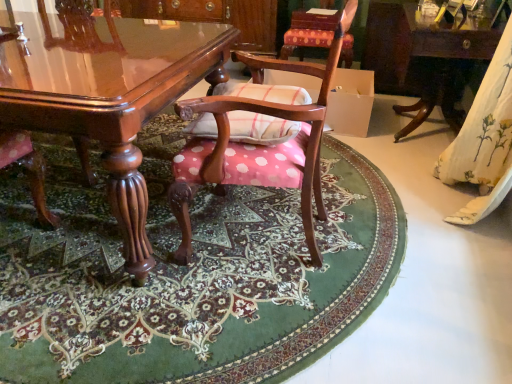
Question: Relative to polka dot fabric chair at center, acting as the 2th chair starting from the bottom, is pink polka dot fabric at center in front or behind?

Choices:
 (A) behind
 (B) front

Answer: (B)

Question: From a real-world perspective, is pink polka dot fabric at center above or below polka dot fabric chair at center, which is counted as the 1th chair, starting from the back?

Choices:
 (A) above
 (B) below

Answer: (B)

Question: Which of these objects is positioned closest to the polka dot fabric chair at center, the first chair from the front?

Choices:
 (A) pink polka dot fabric at center
 (B) polka dot fabric chair at center, the first chair from the top
 (C) glossy wood table at center, the second table viewed from the right
 (D) white floral fabric at right
 (E) wooden table at right, which ranks as the 1th table in right-to-left order

Answer: (C)

Question: Which object is the farthest from the polka dot fabric chair at center, which is counted as the 1th chair, starting from the back?

Choices:
 (A) plaid fabric pillow at center
 (B) glossy wood table at center, which is the 1th table from left to right
 (C) polka dot fabric chair at center, arranged as the 2th chair when viewed from the top
 (D) white floral fabric at right
 (E) wooden table at right, which is the second table in left-to-right order

Answer: (B)